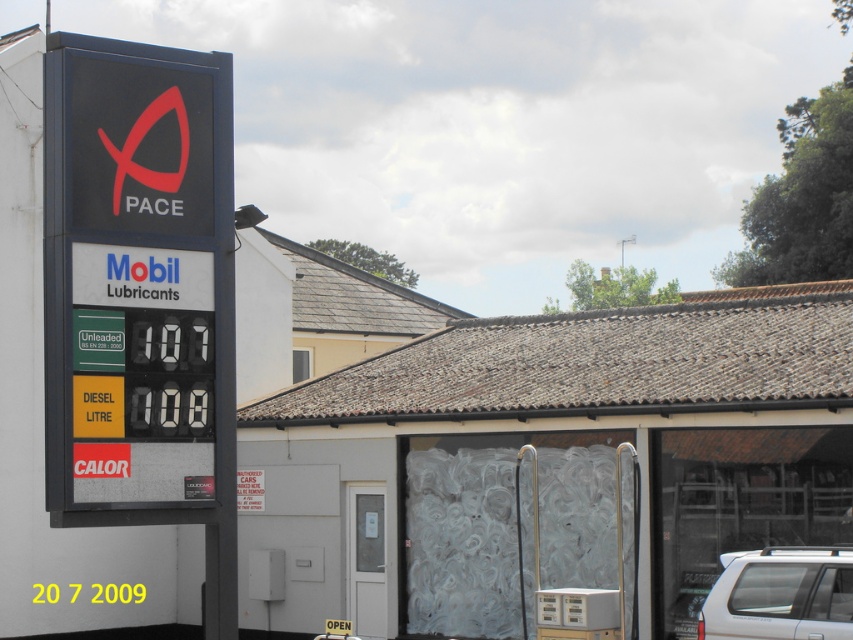
Who is more distant from viewer, (782, 323) or (711, 602)?

Point (782, 323)

Is point (277, 573) farther from camera compared to point (756, 564)?

Yes, it is behind point (756, 564).

This screenshot has width=853, height=640. Identify the location of metallic silver fuel pump at center. (550, 460).

This screenshot has width=853, height=640. Find the location of `metallic silver fuel pump at center`. metallic silver fuel pump at center is located at coordinates (550, 460).